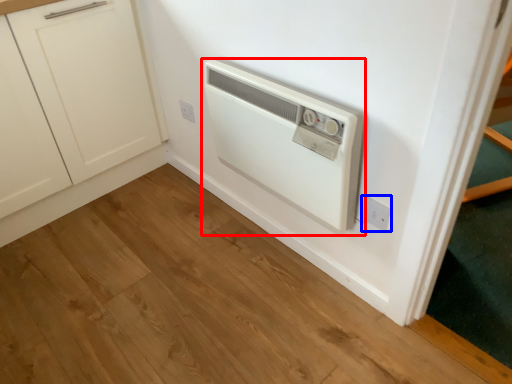
Question: Which object appears farthest to the camera in this image, home appliance (highlighted by a red box) or electric outlet (highlighted by a blue box)?

Choices:
 (A) home appliance
 (B) electric outlet

Answer: (B)